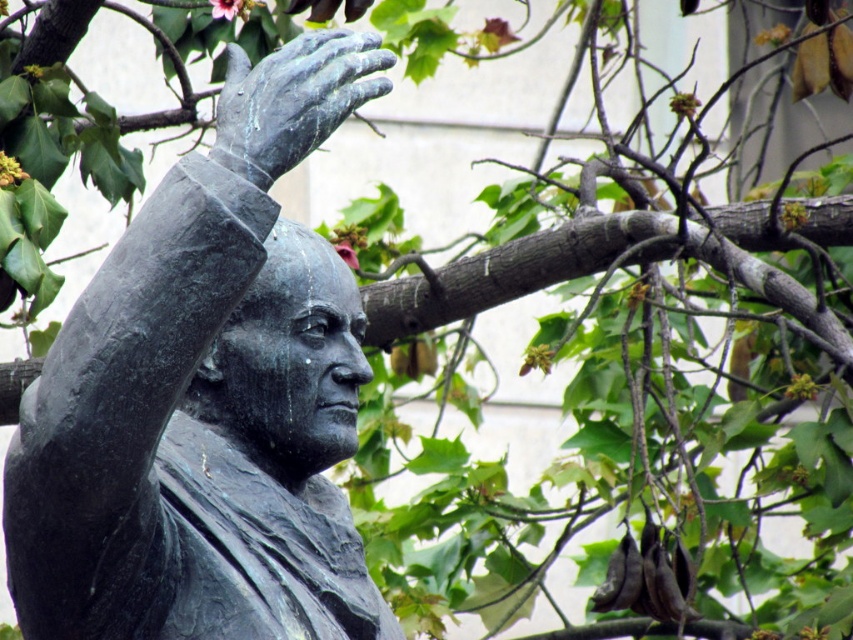
Can you confirm if bronze statue at upper left is smaller than bronze/grey metallic hand at upper center?

Incorrect, bronze statue at upper left is not smaller in size than bronze/grey metallic hand at upper center.

Is bronze statue at upper left closer to camera compared to bronze/grey metallic hand at upper center?

That is True.

Does point (352, 445) come farther from viewer compared to point (335, 92)?

Yes, point (352, 445) is farther from viewer.

At what (x,y) coordinates should I click in order to perform the action: click on bronze statue at upper left. Please return your answer as a coordinate pair (x, y). This screenshot has width=853, height=640. Looking at the image, I should click on (204, 390).